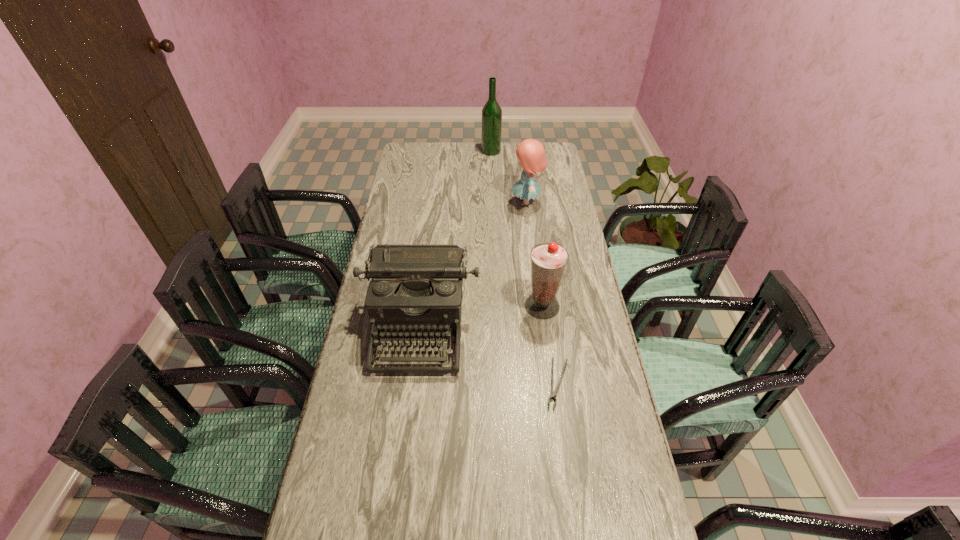
Find the location of a particular element. vacant region located on the front-facing side of the doll is located at coordinates coord(464,203).

Where is `free spot located on the front of the smoothie`? The height and width of the screenshot is (540, 960). free spot located on the front of the smoothie is located at coordinates (553, 392).

Locate an element on the screen. The height and width of the screenshot is (540, 960). vacant space located 0.320m on the typing side of the typewriter is located at coordinates (399, 489).

The image size is (960, 540). In order to click on vacant region located 0.070m on the back of the shortest object in this screenshot , I will do `click(551, 340)`.

Where is `object that is at the far edge`? The width and height of the screenshot is (960, 540). object that is at the far edge is located at coordinates (491, 113).

Locate an element on the screen. This screenshot has height=540, width=960. object at the left edge is located at coordinates (416, 288).

Locate an element on the screen. doll located at the right edge is located at coordinates (531, 153).

I want to click on smoothie located in the right edge section of the desktop, so click(548, 261).

Find the location of a particular element. The width and height of the screenshot is (960, 540). tongs located at the right edge is located at coordinates (553, 393).

In the image, there is a desktop. Identify the location of blank space at the far edge. (485, 165).